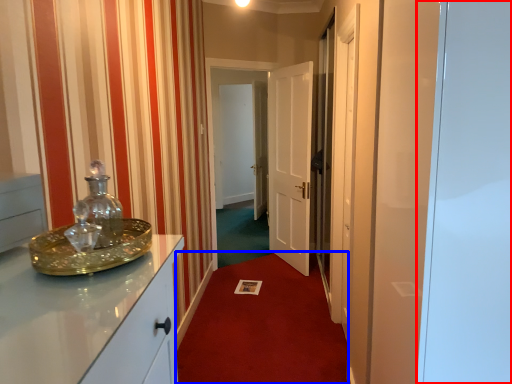
Question: Which object appears closest to the camera in this image, glass door (highlighted by a red box) or plain (highlighted by a blue box)?

Choices:
 (A) glass door
 (B) plain

Answer: (A)